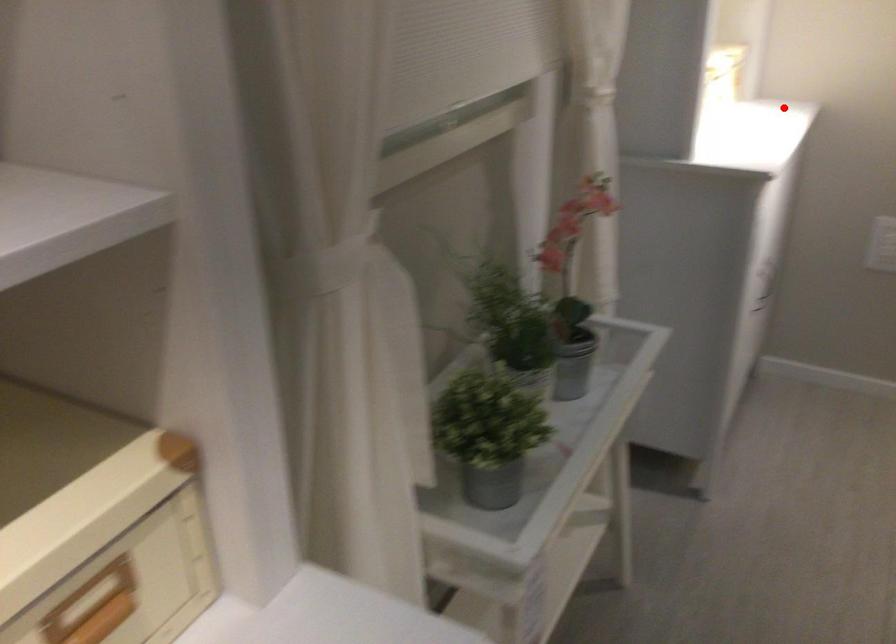
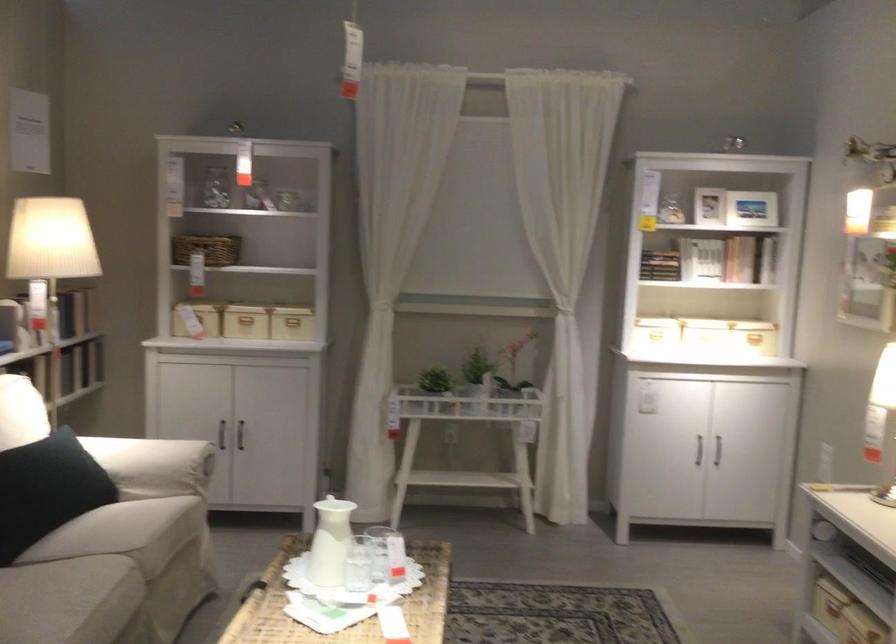
Question: A red point is marked in image1. In image2, is the corresponding 3D point closer to the camera or farther? Reply with the corresponding letter.

Choices:
 (A) The corresponding 3D point is closer.
 (B) The corresponding 3D point is farther.

Answer: (B)